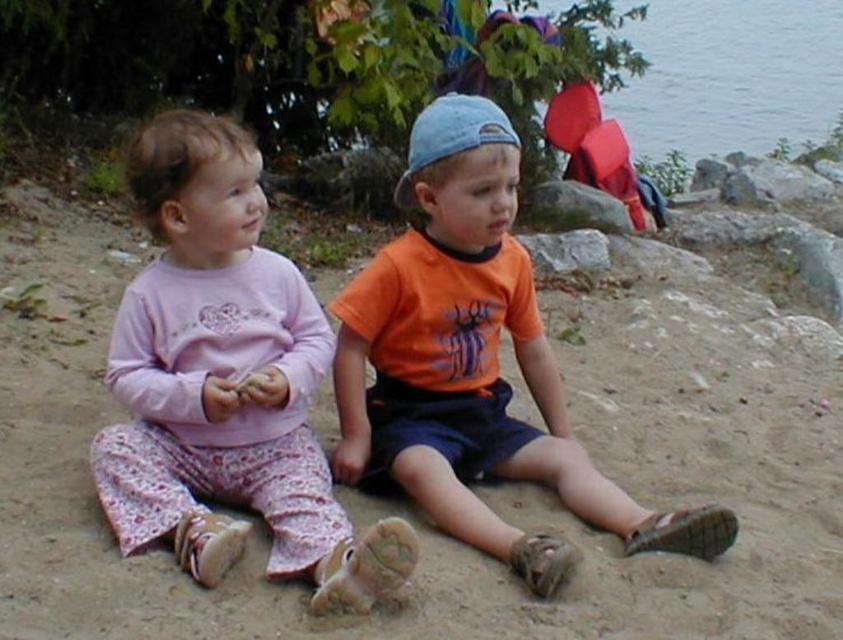
What are the coordinates of the pink cotton pajamas at left?

The pink cotton pajamas at left are located at coordinates point (226, 381).

You are a photographer trying to capture a closeup of the pink cotton pajamas at left. Based on their 2D coordinates, which direction should you move your camera to get a better shot?

The pink cotton pajamas at left are located at point (226, 381). To capture a closeup, move the camera towards the center of the image since the coordinates are closer to the center than the edges.

You are a photographer standing at the back of the scene. You want to take a photo of the orange cotton shirt at center without the transparent water at upper right appearing in the background. Is this possible?

The orange cotton shirt at center is in front of the transparent water at upper right, so you can take a photo of the orange cotton shirt at center without the transparent water at upper right in the background by adjusting the camera angle to focus on the shirt and exclude the water behind it.